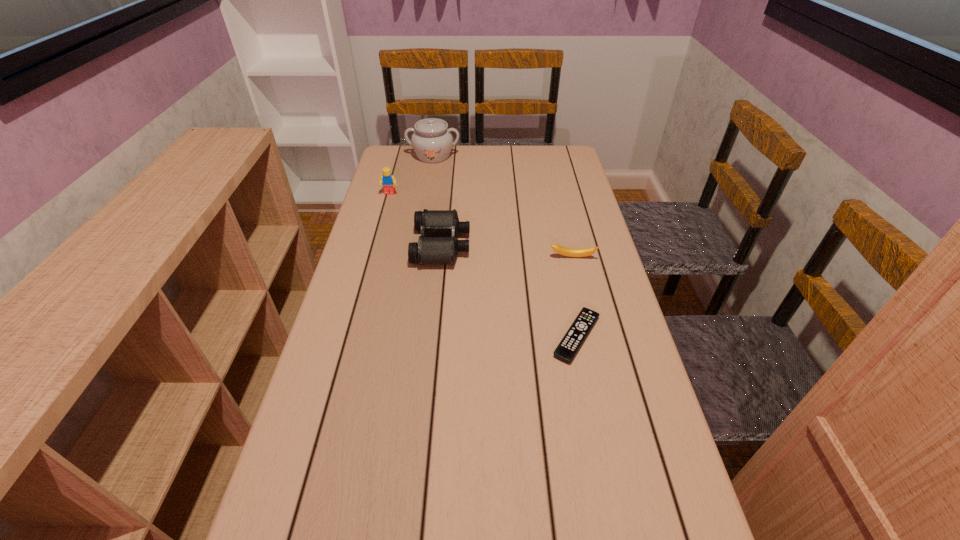
Find the location of a particular element. The height and width of the screenshot is (540, 960). free space located through the eyepieces of the third shortest object is located at coordinates (496, 245).

Image resolution: width=960 pixels, height=540 pixels. I want to click on free space located 0.050m at the stem of the fourth tallest object, so click(576, 272).

You are a GUI agent. You are given a task and a screenshot of the screen. Output one action in this format:
    pyautogui.click(x=<x>, y=<y>)
    Task: Click on the vacant space located on the back of the remote control
    The width and height of the screenshot is (960, 540).
    Given the screenshot: What is the action you would take?
    pyautogui.click(x=562, y=262)

Find the location of a particular element. This screenshot has height=540, width=960. object that is at the far edge is located at coordinates (432, 142).

Identify the location of chinaware that is at the left edge. (432, 142).

Where is `Lego that is positioned at the left edge`? The image size is (960, 540). Lego that is positioned at the left edge is located at coordinates (388, 181).

I want to click on banana that is at the right edge, so click(571, 252).

The image size is (960, 540). In order to click on remote control present at the right edge in this screenshot , I will do `click(571, 342)`.

This screenshot has height=540, width=960. What are the coordinates of `object that is at the far left corner` in the screenshot? It's located at (432, 142).

Image resolution: width=960 pixels, height=540 pixels. In the image, there is a desktop. Find the location of `vacant space at the far edge`. vacant space at the far edge is located at coordinates (456, 158).